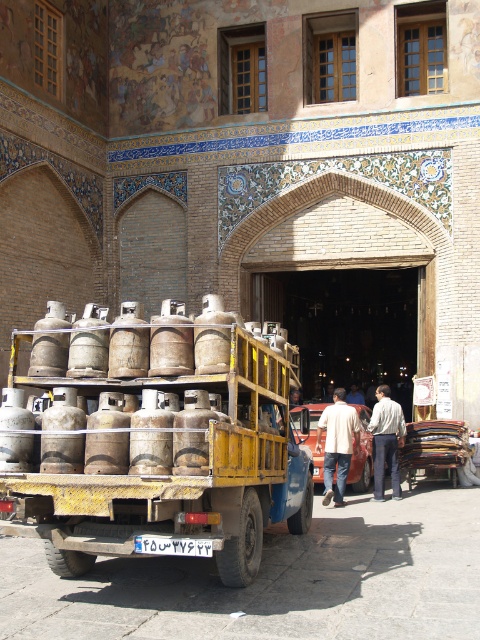
Can you confirm if light beige fabric shirt at center is positioned to the left of light beige sweater at center?

Correct, you'll find light beige fabric shirt at center to the left of light beige sweater at center.

Is light beige fabric shirt at center positioned behind light beige sweater at center?

No, it is in front of light beige sweater at center.

Image resolution: width=480 pixels, height=640 pixels. I want to click on light beige fabric shirt at center, so click(337, 444).

Between rusty metal truck at center and light beige sweater at center, which one appears on the left side from the viewer's perspective?

rusty metal truck at center is more to the left.

Between point (11, 486) and point (381, 420), which one is positioned in front?

Point (11, 486) is more forward.

Identify the location of rusty metal truck at center. pos(167,458).

Who is higher up, rusty metal truck at center or light beige fabric shirt at center?

rusty metal truck at center is above.

Does point (117, 470) come in front of point (349, 452)?

Yes, it is in front of point (349, 452).

Is point (145, 445) in front of point (337, 451)?

Yes, point (145, 445) is in front of point (337, 451).

Where is `rusty metal truck at center`? The image size is (480, 640). rusty metal truck at center is located at coordinates (167, 458).